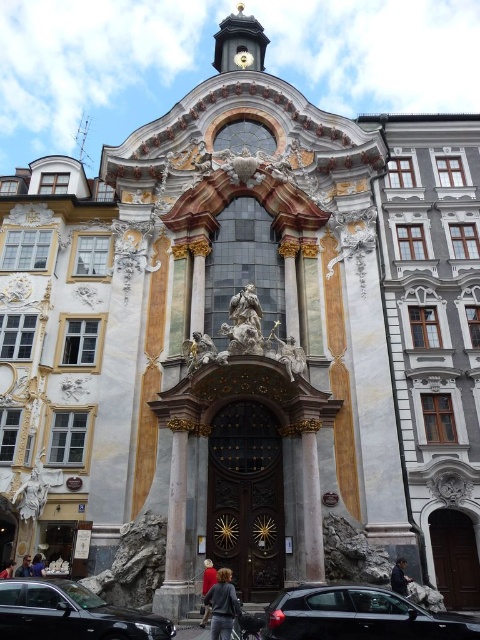
Is shiny black sedan at lower right closer to the viewer compared to red fabric at center?

Yes.

Does shiny black sedan at lower right have a lesser height compared to red fabric at center?

No.

What do you see at coordinates (360, 616) in the screenshot?
I see `shiny black sedan at lower right` at bounding box center [360, 616].

Locate an element on the screen. shiny black sedan at lower right is located at coordinates point(360,616).

What are the coordinates of `dark brown wooden door at center` in the screenshot? It's located at (455, 557).

Who is more distant from viewer, (463, 582) or (28, 561)?

The point (28, 561) is more distant.

Who is more forward, (445, 531) or (24, 556)?

Point (24, 556) is in front.

Where is `dark brown wooden door at center`? The image size is (480, 640). dark brown wooden door at center is located at coordinates (455, 557).

Based on the photo, is dark gray jacket at lower left below dark brown leather jacket at lower left?

No.

Which is below, dark gray jacket at lower left or dark brown leather jacket at lower left?

dark brown leather jacket at lower left is below.

I want to click on dark gray jacket at lower left, so click(24, 566).